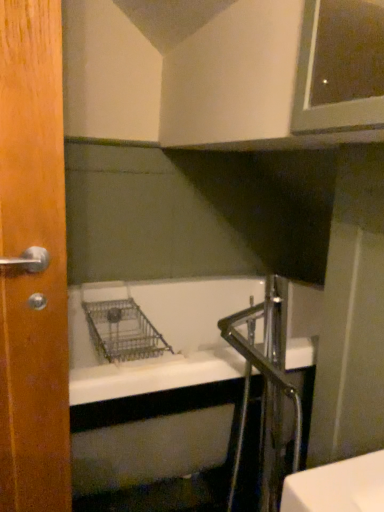
In order to face metallic silver faucet at lower right, should I rotate leftwards or rightwards?

Rotate right and turn 10.220 degrees.

At what (x,y) coordinates should I click in order to perform the action: click on metallic silver faucet at lower right. Please return your answer as a coordinate pair (x, y). Looking at the image, I should click on (266, 387).

The image size is (384, 512). What do you see at coordinates (266, 387) in the screenshot?
I see `metallic silver faucet at lower right` at bounding box center [266, 387].

Describe the element at coordinates (33, 275) in the screenshot. The width and height of the screenshot is (384, 512). I see `wooden door at left` at that location.

Find the location of a particular element. The image size is (384, 512). wooden door at left is located at coordinates (33, 275).

In order to click on metallic silver faucet at lower right in this screenshot , I will do `click(266, 387)`.

Can you confirm if metallic silver faucet at lower right is positioned to the right of wooden door at left?

Indeed, metallic silver faucet at lower right is positioned on the right side of wooden door at left.

Relative to wooden door at left, is metallic silver faucet at lower right in front or behind?

metallic silver faucet at lower right is behind wooden door at left.

Which is less distant, (251, 335) or (9, 506)?

Point (251, 335) is farther from the camera than point (9, 506).

From the image's perspective, is metallic silver faucet at lower right above or below wooden door at left?

Clearly, from the image's perspective, metallic silver faucet at lower right is below wooden door at left.

From a real-world perspective, which object rests below the other?

metallic silver faucet at lower right.

Considering the sizes of metallic silver faucet at lower right and wooden door at left in the image, is metallic silver faucet at lower right wider or thinner than wooden door at left?

Considering their sizes, metallic silver faucet at lower right looks broader than wooden door at left.

Between metallic silver faucet at lower right and wooden door at left, which one has less height?

Standing shorter between the two is metallic silver faucet at lower right.

Considering the relative sizes of metallic silver faucet at lower right and wooden door at left in the image provided, is metallic silver faucet at lower right bigger than wooden door at left?

Yes, metallic silver faucet at lower right is bigger than wooden door at left.

Which is correct: metallic silver faucet at lower right is inside wooden door at left, or outside of it?

metallic silver faucet at lower right exists outside the volume of wooden door at left.

Is metallic silver faucet at lower right not near wooden door at left?

They are positioned close to each other.

Could you tell me if metallic silver faucet at lower right is facing wooden door at left?

Yes.

What's the angular difference between metallic silver faucet at lower right and wooden door at left's facing directions?

They differ by 90.4 degrees in their facing directions.

How far apart are metallic silver faucet at lower right and wooden door at left?

metallic silver faucet at lower right is 20.67 inches away from wooden door at left.

What are the coordinates of `faucet that appears below the wooden door at left (from the image's perspective)` in the screenshot? It's located at (266, 387).

Can you confirm if wooden door at left is positioned to the right of metallic silver faucet at lower right?

No, wooden door at left is not to the right of metallic silver faucet at lower right.

Relative to metallic silver faucet at lower right, is wooden door at left in front or behind?

wooden door at left is in front of metallic silver faucet at lower right.

Is point (63, 392) less distant than point (275, 490)?

Yes, point (63, 392) is in front of point (275, 490).

From the image's perspective, is wooden door at left positioned above or below metallic silver faucet at lower right?

wooden door at left is above metallic silver faucet at lower right.

From a real-world perspective, who is located lower, wooden door at left or metallic silver faucet at lower right?

From a 3D spatial view, metallic silver faucet at lower right is below.

Can you confirm if wooden door at left is wider than metallic silver faucet at lower right?

No.

Considering the relative sizes of wooden door at left and metallic silver faucet at lower right in the image provided, is wooden door at left taller than metallic silver faucet at lower right?

Yes, wooden door at left is taller than metallic silver faucet at lower right.

Which of these two, wooden door at left or metallic silver faucet at lower right, is smaller?

With smaller size is wooden door at left.

Choose the correct answer: Is wooden door at left inside metallic silver faucet at lower right or outside it?

wooden door at left is spatially situated outside metallic silver faucet at lower right.

Would you say wooden door at left is a long distance from metallic silver faucet at lower right?

wooden door at left is actually quite close to metallic silver faucet at lower right.

Is wooden door at left oriented away from metallic silver faucet at lower right?

No, wooden door at left is not facing away from metallic silver faucet at lower right.

How many degrees apart are the facing directions of wooden door at left and metallic silver faucet at lower right?

There is a 90.4-degree angle between the facing directions of wooden door at left and metallic silver faucet at lower right.

Locate an element on the screen. The height and width of the screenshot is (512, 384). faucet below the wooden door at left (from a real-world perspective) is located at coordinates (266, 387).

Locate an element on the screen. The width and height of the screenshot is (384, 512). door above the metallic silver faucet at lower right (from a real-world perspective) is located at coordinates (33, 275).

Find the location of a particular element. The height and width of the screenshot is (512, 384). door on the left side of metallic silver faucet at lower right is located at coordinates (33, 275).